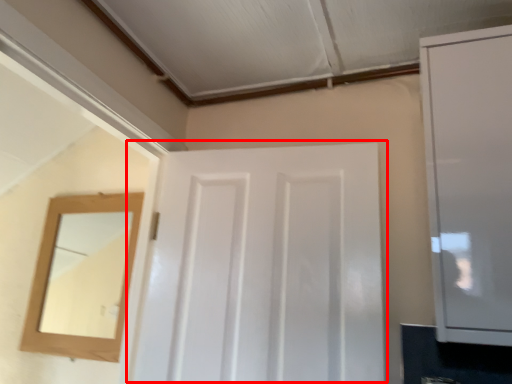
Question: From the image's perspective, what is the correct spatial positioning of door (annotated by the red box) in reference to cabinetry?

Choices:
 (A) above
 (B) below

Answer: (B)